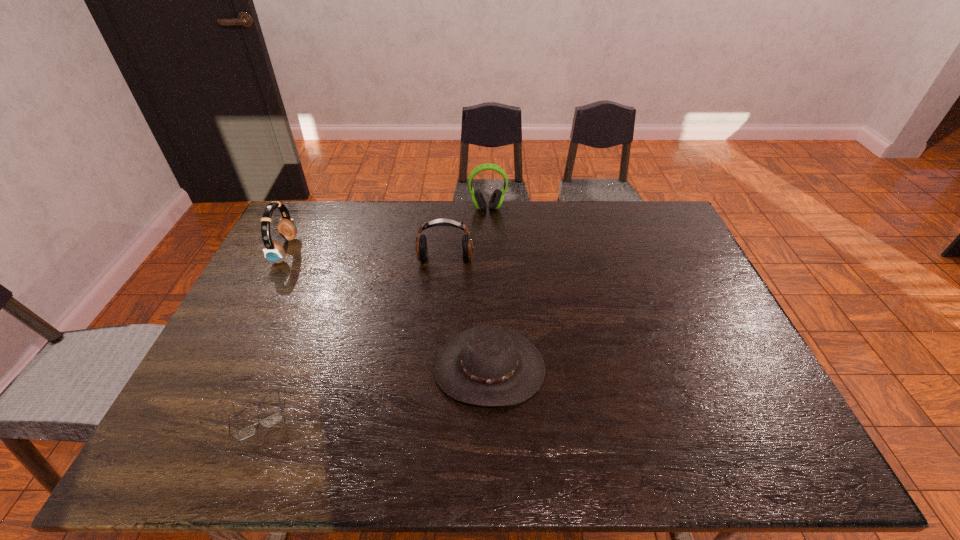
Locate an element on the screen. The width and height of the screenshot is (960, 540). the farthest headset is located at coordinates (497, 197).

The image size is (960, 540). Find the location of `the leftmost headset`. the leftmost headset is located at coordinates (274, 251).

Identify the location of hat. (491, 365).

Locate an element on the screen. This screenshot has height=540, width=960. spectacles is located at coordinates (275, 418).

Where is `the shortest object`? the shortest object is located at coordinates (275, 418).

The image size is (960, 540). In order to click on vacant area located 0.250m on the right of the farthest object in this screenshot , I will do click(x=573, y=208).

Identify the location of free spot located on the ear cup of the leftmost headset. (363, 250).

Locate an element on the screen. This screenshot has height=540, width=960. free space located on the front-facing side of the second shortest object is located at coordinates (491, 448).

You are a GUI agent. You are given a task and a screenshot of the screen. Output one action in this format:
    pyautogui.click(x=<x>, y=<y>)
    Task: Click on the blank space located with the lenses facing outward on the shortest object
    The height and width of the screenshot is (540, 960).
    Given the screenshot: What is the action you would take?
    pyautogui.click(x=241, y=464)

Where is `object at the near edge`? object at the near edge is located at coordinates coord(275,418).